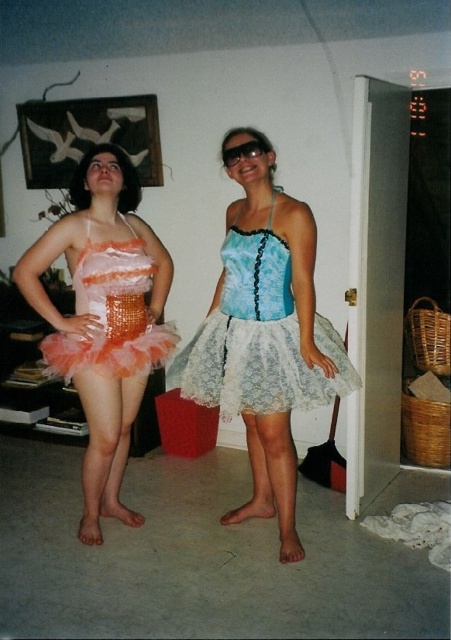
You are a costume designer who needs to choose between the lace fabric tutu skirt at center and the shiny orange sequined tutu at left for a performance. Based on their sizes, which one would you recommend if you want a more dramatic effect?

The lace fabric tutu skirt at center is bigger than the shiny orange sequined tutu at left, so it would provide a more dramatic effect due to its larger size.

You are trying to navigate through a room where two points are marked. The first point is at coordinate point (256,236) and the second is at point (124,268). If you want to move from the first point to the second point, which direction should you move in relation to the scene?

To move from point (256,236) to point (124,268), you should move downward and to the right since point (256,236) is in front of point (124,268), indicating it is closer to the viewer. Moving towards the second point would require going away from the viewer, which in coordinate terms translates to downward and rightward direction based on standard image coordinate systems.